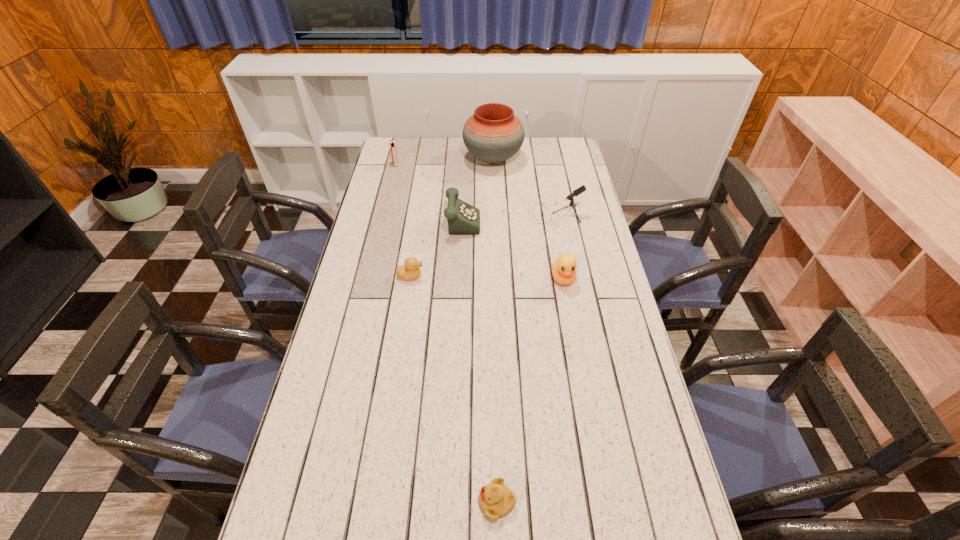
Identify the location of pottery located at the far edge. The height and width of the screenshot is (540, 960). click(x=493, y=134).

Where is `igniter that is at the far edge`? igniter that is at the far edge is located at coordinates (392, 144).

Where is `object that is at the left edge`? object that is at the left edge is located at coordinates (392, 144).

Locate an element on the screen. microphone that is positioned at the right edge is located at coordinates (581, 189).

Locate an element on the screen. duckling present at the right edge is located at coordinates (564, 267).

You are a GUI agent. You are given a task and a screenshot of the screen. Output one action in this format:
    pyautogui.click(x=<x>, y=<y>)
    Task: Click on the object at the far left corner
    This screenshot has width=960, height=540.
    Given the screenshot: What is the action you would take?
    pyautogui.click(x=392, y=144)

I want to click on free space at the left edge of the desktop, so click(x=295, y=477).

This screenshot has width=960, height=540. I want to click on blank space at the right edge of the desktop, so click(580, 183).

Image resolution: width=960 pixels, height=540 pixels. I want to click on free region at the far right corner, so click(x=555, y=140).

Locate an element on the screen. Image resolution: width=960 pixels, height=540 pixels. free space between the telephone and the sixth tallest object is located at coordinates (434, 247).